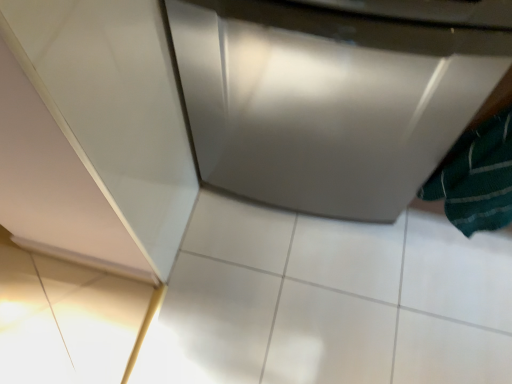
The height and width of the screenshot is (384, 512). I want to click on satin silver dishwasher at center, so click(335, 94).

Image resolution: width=512 pixels, height=384 pixels. Describe the element at coordinates (335, 94) in the screenshot. I see `satin silver dishwasher at center` at that location.

The height and width of the screenshot is (384, 512). Identify the location of green textured towel at lower right. (477, 178).

What do you see at coordinates (477, 178) in the screenshot? The height and width of the screenshot is (384, 512). I see `green textured towel at lower right` at bounding box center [477, 178].

Where is `satin silver dishwasher at center`? satin silver dishwasher at center is located at coordinates (335, 94).

Does green textured towel at lower right appear on the right side of satin silver dishwasher at center?

Yes.

Considering the positions of objects green textured towel at lower right and satin silver dishwasher at center in the image provided, who is behind, green textured towel at lower right or satin silver dishwasher at center?

satin silver dishwasher at center is more distant.

Between point (486, 164) and point (439, 117), which one is positioned in front?

The point (439, 117) is more forward.

From the image's perspective, is green textured towel at lower right located above or below satin silver dishwasher at center?

Clearly, from the image's perspective, green textured towel at lower right is below satin silver dishwasher at center.

From a real-world perspective, which object rests below the other?

satin silver dishwasher at center.

Which of these two, green textured towel at lower right or satin silver dishwasher at center, is wider?

satin silver dishwasher at center is wider.

From their relative heights in the image, would you say green textured towel at lower right is taller or shorter than satin silver dishwasher at center?

In the image, green textured towel at lower right appears to be shorter than satin silver dishwasher at center.

Looking at this image, can you confirm if green textured towel at lower right is bigger than satin silver dishwasher at center?

No, green textured towel at lower right is not bigger than satin silver dishwasher at center.

Would you say green textured towel at lower right is outside satin silver dishwasher at center?

Yes, green textured towel at lower right is not within satin silver dishwasher at center.

Would you consider green textured towel at lower right to be distant from satin silver dishwasher at center?

green textured towel at lower right is actually quite close to satin silver dishwasher at center.

Is green textured towel at lower right oriented away from satin silver dishwasher at center?

That's not correct — green textured towel at lower right is not looking away from satin silver dishwasher at center.

How many degrees apart are the facing directions of green textured towel at lower right and satin silver dishwasher at center?

0.000441 degrees.

Where is `home appliance directly beneath the green textured towel at lower right (from a real-world perspective)`? The height and width of the screenshot is (384, 512). home appliance directly beneath the green textured towel at lower right (from a real-world perspective) is located at coordinates (335, 94).

Considering the relative positions of satin silver dishwasher at center and green textured towel at lower right in the image provided, is satin silver dishwasher at center to the left of green textured towel at lower right from the viewer's perspective?

Correct, you'll find satin silver dishwasher at center to the left of green textured towel at lower right.

Which object is closer to the camera taking this photo, satin silver dishwasher at center or green textured towel at lower right?

green textured towel at lower right.

Considering the points (418, 97) and (417, 196), which point is in front, point (418, 97) or point (417, 196)?

The point (418, 97) is more forward.

From the image's perspective, relative to green textured towel at lower right, is satin silver dishwasher at center above or below?

satin silver dishwasher at center is above green textured towel at lower right.

From a real-world perspective, between satin silver dishwasher at center and green textured towel at lower right, who is vertically lower?

satin silver dishwasher at center, from a real-world perspective.

Considering the relative sizes of satin silver dishwasher at center and green textured towel at lower right in the image provided, is satin silver dishwasher at center wider than green textured towel at lower right?

Indeed, satin silver dishwasher at center has a greater width compared to green textured towel at lower right.

Considering the sizes of objects satin silver dishwasher at center and green textured towel at lower right in the image provided, who is taller, satin silver dishwasher at center or green textured towel at lower right?

satin silver dishwasher at center.

Between satin silver dishwasher at center and green textured towel at lower right, which one has smaller size?

Smaller between the two is green textured towel at lower right.

Would you say satin silver dishwasher at center is outside green textured towel at lower right?

Yes, satin silver dishwasher at center is outside of green textured towel at lower right.

Is satin silver dishwasher at center far from green textured towel at lower right?

No, satin silver dishwasher at center is not far from green textured towel at lower right.

Could you tell me if satin silver dishwasher at center is turned towards green textured towel at lower right?

No, satin silver dishwasher at center does not turn towards green textured towel at lower right.

Measure the distance between satin silver dishwasher at center and green textured towel at lower right.

satin silver dishwasher at center and green textured towel at lower right are 10.36 inches apart.

Identify the location of bath towel below the satin silver dishwasher at center (from the image's perspective). (477, 178).

At what (x,y) coordinates should I click in order to perform the action: click on bath towel lying in front of the satin silver dishwasher at center. Please return your answer as a coordinate pair (x, y). Looking at the image, I should click on (477, 178).

Where is `bath towel to the right of satin silver dishwasher at center`? bath towel to the right of satin silver dishwasher at center is located at coordinates (477, 178).